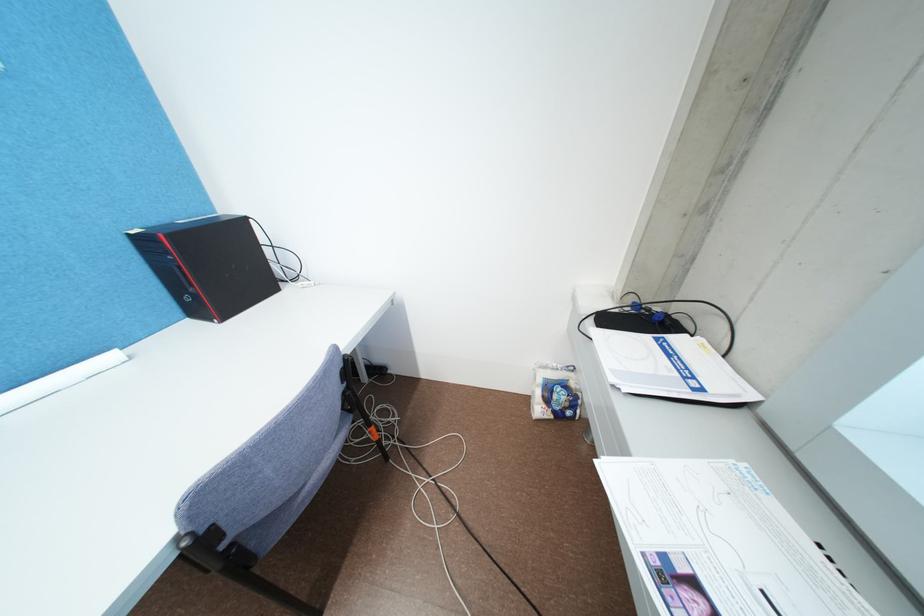
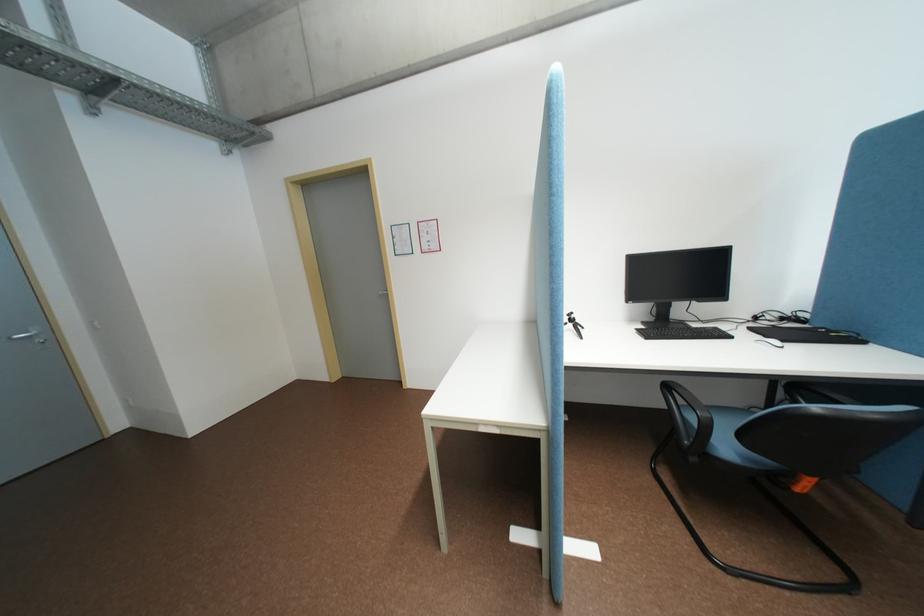
Question: In a continuous first-person perspective shot, in which direction is the camera moving?

Choices:
 (A) Left
 (B) Right
 (C) Forward
 (D) Backward

Answer: (A)